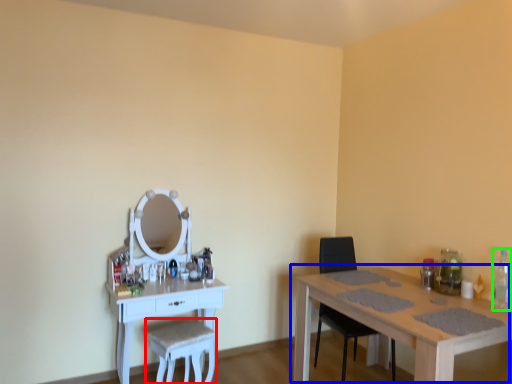
Question: Which object is the closest to the swivel chair (highlighted by a red box)? Choose among these: table (highlighted by a blue box) or bottle (highlighted by a green box).

Choices:
 (A) table
 (B) bottle

Answer: (A)